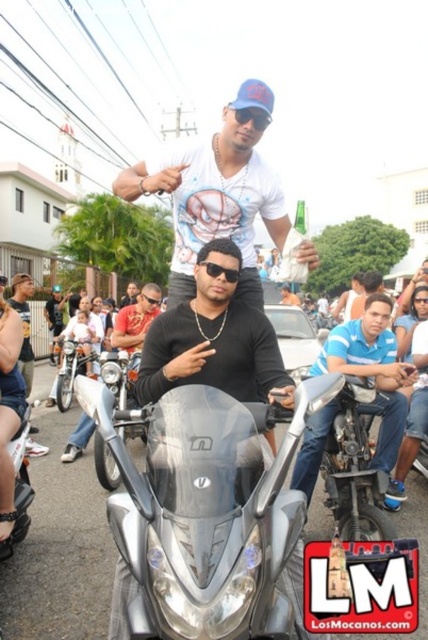
Question: Does silver metallic motorcycle at center lie behind white printed t-shirt at center?

Choices:
 (A) yes
 (B) no

Answer: (B)

Question: Estimate the real-world distances between objects in this image. Which object is farther from the blue cotton shirt at center?

Choices:
 (A) black leather jacket at center
 (B) shiny chrome motorcycle at center
 (C) silver metallic motorcycle at center

Answer: (B)

Question: Based on their relative distances, which object is farther from the black leather jacket at center?

Choices:
 (A) shiny chrome motorcycle at center
 (B) silver metallic motorcycle at center
 (C) sleek silver motorcycle at center
 (D) blue cotton shirt at center

Answer: (B)

Question: Observing the image, what is the correct spatial positioning of silver metallic motorcycle at center in reference to black leather jacket at center?

Choices:
 (A) above
 (B) below

Answer: (B)

Question: Which object is the closest to the sleek silver motorcycle at center?

Choices:
 (A) silver metallic motorcycle at center
 (B) black leather jacket at center
 (C) white printed t-shirt at center
 (D) blue cotton shirt at center

Answer: (C)

Question: Does black leather jacket at center have a lesser width compared to shiny chrome motorcycle at center?

Choices:
 (A) no
 (B) yes

Answer: (B)